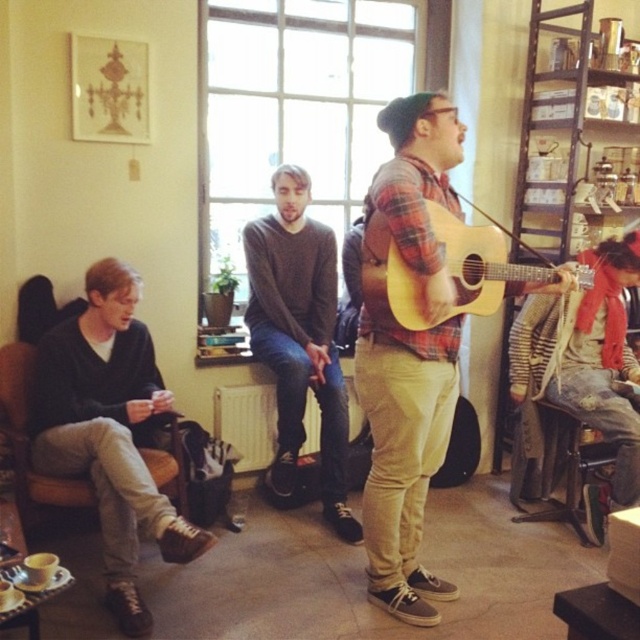
Is point (401, 547) positioned behind point (404, 292)?

Yes, it is behind point (404, 292).

Which is in front, point (380, 444) or point (445, 236)?

Point (445, 236) is in front.

Identify the location of matte plaid shirt at center. The height and width of the screenshot is (640, 640). (404, 452).

Is point (308, 188) closer to camera compared to point (625, 460)?

No, it is not.

Is dark gray sweater at center bigger than striped sweater at lower right?

Yes, dark gray sweater at center is bigger than striped sweater at lower right.

Locate an element on the screen. The image size is (640, 640). dark gray sweater at center is located at coordinates (300, 340).

Which is more to the right, dark gray sweater at center or light brown wooden guitar at center?

light brown wooden guitar at center

In the scene shown: Between dark gray sweater at center and light brown wooden guitar at center, which one has more height?

dark gray sweater at center is taller.

You are a GUI agent. You are given a task and a screenshot of the screen. Output one action in this format:
    pyautogui.click(x=<x>, y=<y>)
    Task: Click on the dark gray sweater at center
    The width and height of the screenshot is (640, 640).
    Given the screenshot: What is the action you would take?
    pyautogui.click(x=300, y=340)

The height and width of the screenshot is (640, 640). I want to click on dark gray sweater at center, so click(x=300, y=340).